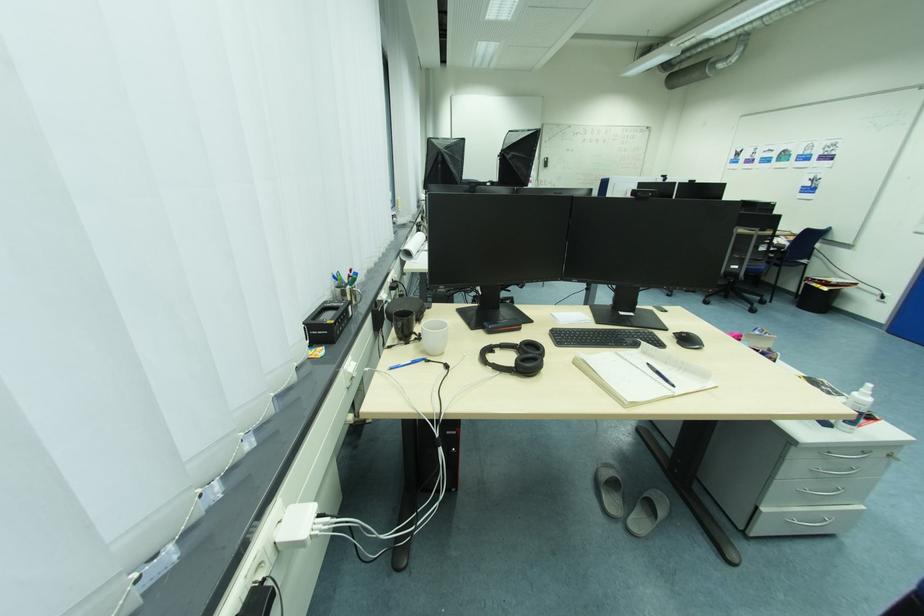
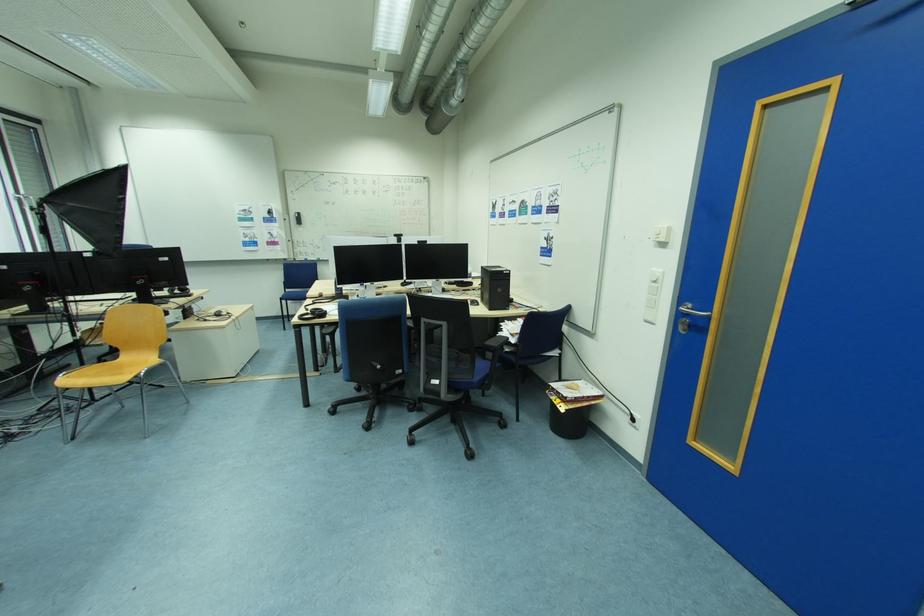
Where in the second image is the point corresponding to the point at 833,290 from the first image?

(569, 408)